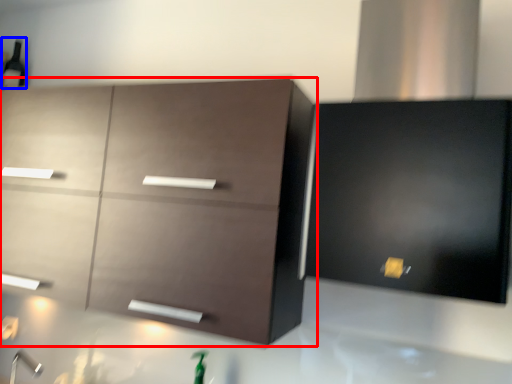
Question: Which object appears farthest to the camera in this image, cabinetry (highlighted by a red box) or beer bottle (highlighted by a blue box)?

Choices:
 (A) cabinetry
 (B) beer bottle

Answer: (B)